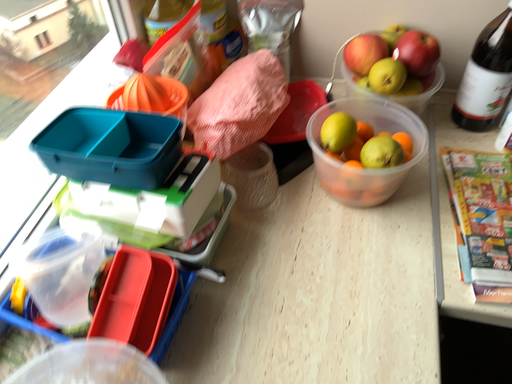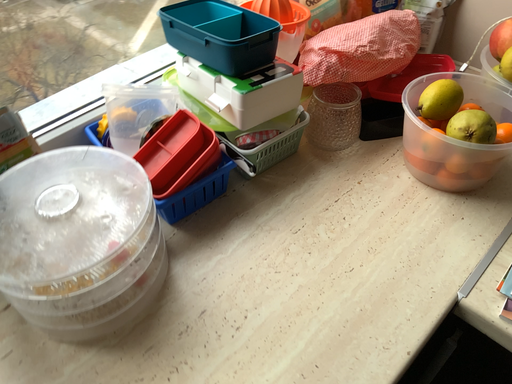
Question: How did the camera likely rotate when shooting the video?

Choices:
 (A) rotated right
 (B) rotated left

Answer: (B)